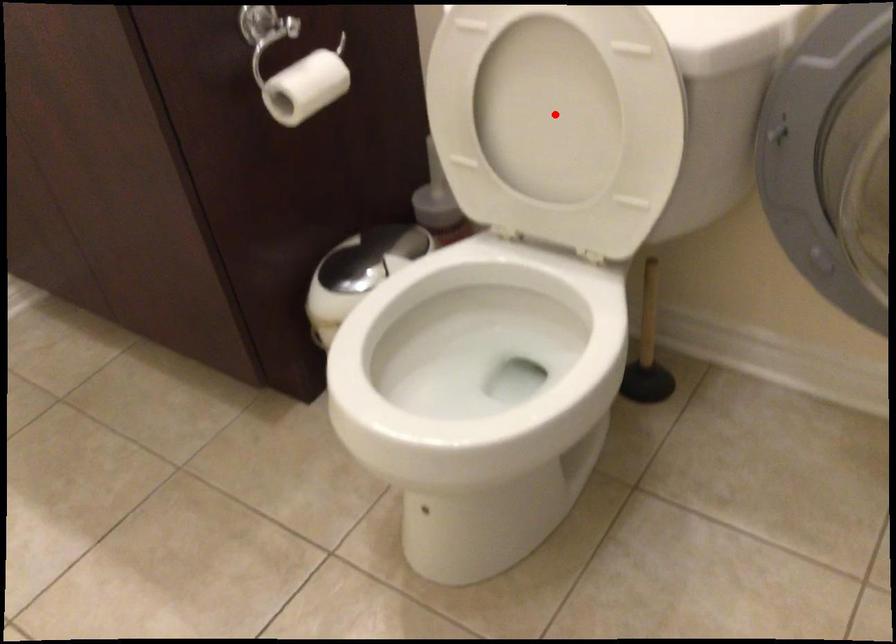
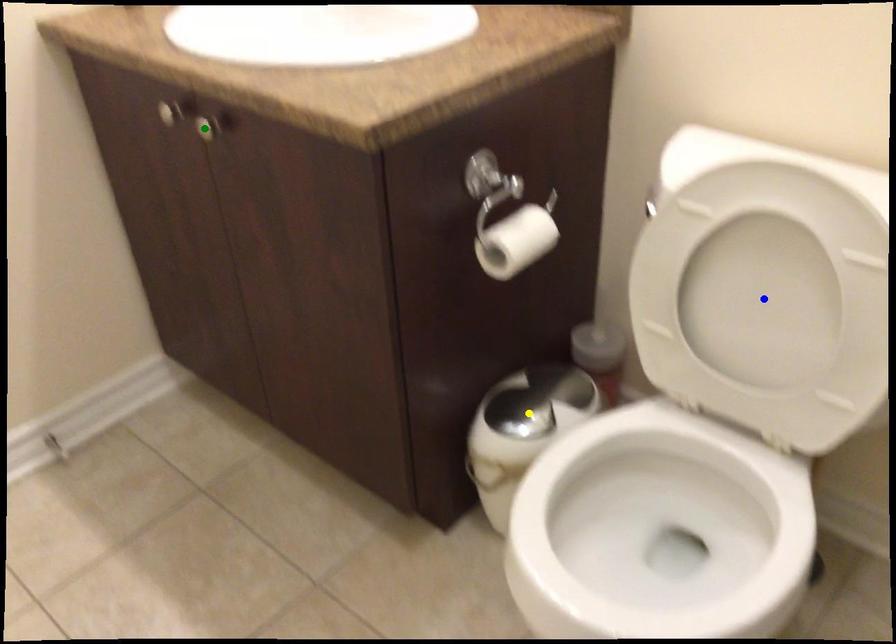
Question: I am providing you with two images of the same scene from different viewpoints. A red point is marked on the first image. You are given multiple points on the second image. Which mark in image 2 goes with the point in image 1?

Choices:
 (A) green point
 (B) yellow point
 (C) blue point

Answer: (C)